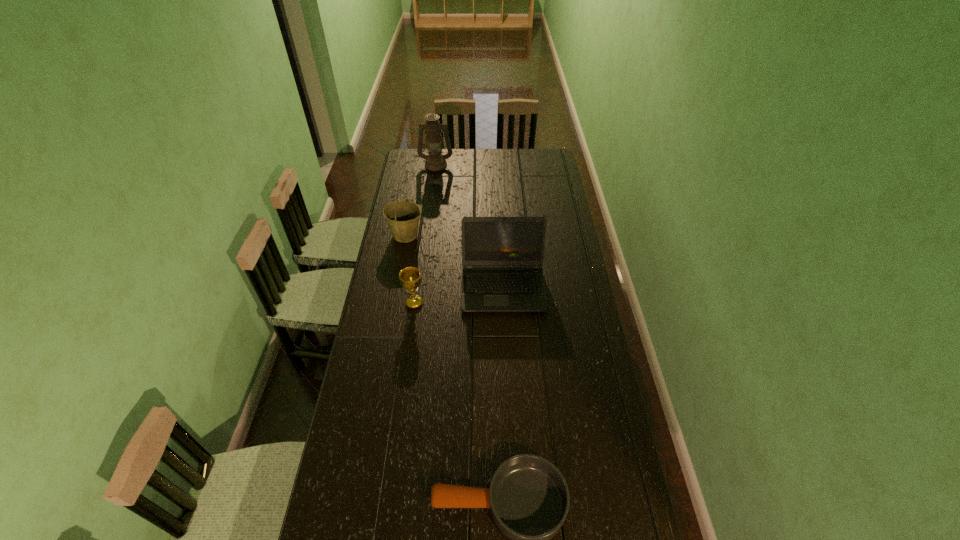
Identify the location of oil lamp located at the left edge. The height and width of the screenshot is (540, 960). (435, 161).

Locate an element on the screen. The width and height of the screenshot is (960, 540). wine bucket present at the left edge is located at coordinates (402, 216).

At what (x,y) coordinates should I click in order to perform the action: click on chalice present at the left edge. Please return your answer as a coordinate pair (x, y). Looking at the image, I should click on (410, 278).

The width and height of the screenshot is (960, 540). Find the location of `object at the far left corner`. object at the far left corner is located at coordinates (435, 161).

Image resolution: width=960 pixels, height=540 pixels. Find the location of `free space at the far edge of the desktop`. free space at the far edge of the desktop is located at coordinates (520, 152).

The height and width of the screenshot is (540, 960). What are the coordinates of `free space at the left edge of the desktop` in the screenshot? It's located at (364, 397).

At what (x,y) coordinates should I click in order to perform the action: click on vacant region at the right edge. Please return your answer as a coordinate pair (x, y). The height and width of the screenshot is (540, 960). Looking at the image, I should click on (561, 252).

Image resolution: width=960 pixels, height=540 pixels. I want to click on free spot between the fourth tallest object and the laptop_computer, so click(x=459, y=295).

Find the location of `free space between the laptop_computer and the second farthest object`. free space between the laptop_computer and the second farthest object is located at coordinates (454, 261).

Locate an element on the screen. The image size is (960, 540). vacant space that is in between the tallest object and the chalice is located at coordinates (425, 233).